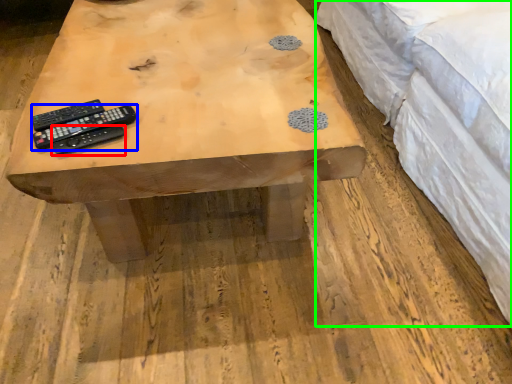
Question: Which is farther away from remote control (highlighted by a red box)? remote control (highlighted by a blue box) or bed (highlighted by a green box)?

Choices:
 (A) remote control
 (B) bed

Answer: (B)